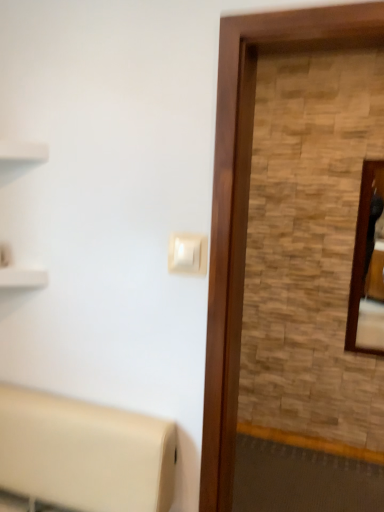
Describe the element at coordinates (248, 204) in the screenshot. I see `wooden screen door at right` at that location.

The image size is (384, 512). I want to click on wooden screen door at right, so click(248, 204).

The height and width of the screenshot is (512, 384). In order to click on wooden frame mirror at right in this screenshot , I will do `click(368, 267)`.

What's the angular difference between white plastic light switch at center and wooden frame mirror at right's facing directions?

The angle between the facing direction of white plastic light switch at center and the facing direction of wooden frame mirror at right is 1.66 degrees.

Considering the sizes of objects white plastic light switch at center and wooden frame mirror at right in the image provided, who is bigger, white plastic light switch at center or wooden frame mirror at right?

Bigger between the two is wooden frame mirror at right.

Is white plastic light switch at center at the right side of wooden frame mirror at right?

In fact, white plastic light switch at center is to the left of wooden frame mirror at right.

Is white plastic light switch at center closer to the viewer compared to wooden frame mirror at right?

Yes, the depth of white plastic light switch at center is less than that of wooden frame mirror at right.

I want to click on light switch that appears above the wooden screen door at right (from the image's perspective), so (187, 254).

Would you say white plastic light switch at center is outside wooden screen door at right?

Yes.

Considering the positions of objects white plastic light switch at center and wooden screen door at right in the image provided, who is behind, white plastic light switch at center or wooden screen door at right?

white plastic light switch at center is further from the camera.

Would you say white plastic light switch at center is to the left or to the right of wooden screen door at right in the picture?

white plastic light switch at center is positioned on wooden screen door at right's left side.

Is wooden frame mirror at right facing towards wooden screen door at right?

Yes, wooden frame mirror at right is turned towards wooden screen door at right.

Is wooden frame mirror at right wider or thinner than wooden screen door at right?

wooden frame mirror at right is thinner than wooden screen door at right.

Is wooden frame mirror at right not inside wooden screen door at right?

Yes, wooden frame mirror at right is located beyond the bounds of wooden screen door at right.

From a real-world perspective, between wooden frame mirror at right and wooden screen door at right, who is vertically higher?

wooden screen door at right.

Does wooden screen door at right have a greater height compared to white plastic light switch at center?

Correct, wooden screen door at right is much taller as white plastic light switch at center.

Could you tell me if wooden screen door at right is facing white plastic light switch at center?

No, wooden screen door at right is not facing towards white plastic light switch at center.

Considering the relative sizes of wooden screen door at right and white plastic light switch at center in the image provided, is wooden screen door at right thinner than white plastic light switch at center?

No.

From the image's perspective, does wooden screen door at right appear higher than white plastic light switch at center?

No.

Looking at their sizes, would you say wooden screen door at right is wider or thinner than wooden frame mirror at right?

In the image, wooden screen door at right appears to be wider than wooden frame mirror at right.

Is wooden screen door at right to the left or to the right of wooden frame mirror at right in the image?

Based on their positions, wooden screen door at right is located to the left of wooden frame mirror at right.

Could you tell me if wooden screen door at right is turned towards wooden frame mirror at right?

No, wooden screen door at right is not turned towards wooden frame mirror at right.

Is wooden screen door at right further to the viewer compared to wooden frame mirror at right?

That is False.

In the image, there is a white plastic light switch at center. Find the location of `mirror below it (from a real-world perspective)`. mirror below it (from a real-world perspective) is located at coordinates (368, 267).

Which object is positioned more to the right, wooden frame mirror at right or white plastic light switch at center?

wooden frame mirror at right is more to the right.

In the scene shown: Considering the relative sizes of wooden frame mirror at right and white plastic light switch at center in the image provided, is wooden frame mirror at right wider than white plastic light switch at center?

Indeed, wooden frame mirror at right has a greater width compared to white plastic light switch at center.

Looking at this image, which of these two, wooden frame mirror at right or white plastic light switch at center, stands taller?

Standing taller between the two is wooden frame mirror at right.

The width and height of the screenshot is (384, 512). I want to click on mirror lying on the right of white plastic light switch at center, so click(368, 267).

The height and width of the screenshot is (512, 384). I want to click on screen door below the white plastic light switch at center (from the image's perspective), so click(x=248, y=204).

Based on their spatial positions, is wooden screen door at right or wooden frame mirror at right further from white plastic light switch at center?

wooden frame mirror at right is further to white plastic light switch at center.

Based on their spatial positions, is wooden screen door at right or white plastic light switch at center closer to wooden frame mirror at right?

Among the two, wooden screen door at right is located nearer to wooden frame mirror at right.

Which object lies nearer to the anchor point wooden screen door at right, white plastic light switch at center or wooden frame mirror at right?

white plastic light switch at center is closer to wooden screen door at right.

Looking at the image, which one is located further to white plastic light switch at center, wooden frame mirror at right or wooden screen door at right?

wooden frame mirror at right lies further to white plastic light switch at center than the other object.

Based on their spatial positions, is wooden frame mirror at right or white plastic light switch at center further from wooden screen door at right?

wooden frame mirror at right is positioned further to the anchor wooden screen door at right.

Considering their positions, is white plastic light switch at center positioned closer to wooden frame mirror at right than wooden screen door at right?

The object closer to wooden frame mirror at right is wooden screen door at right.

Image resolution: width=384 pixels, height=512 pixels. I want to click on light switch located between wooden screen door at right and wooden frame mirror at right in the depth direction, so click(x=187, y=254).